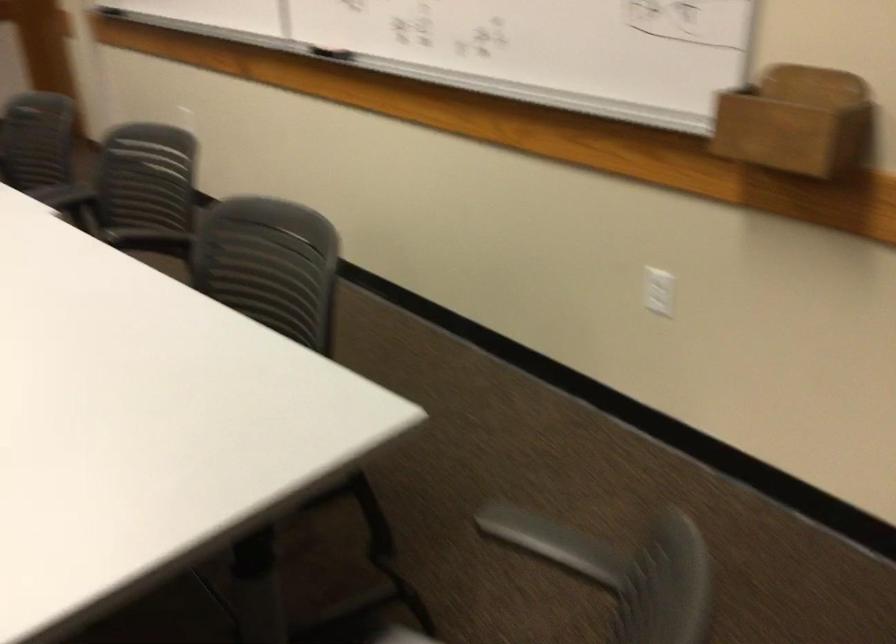
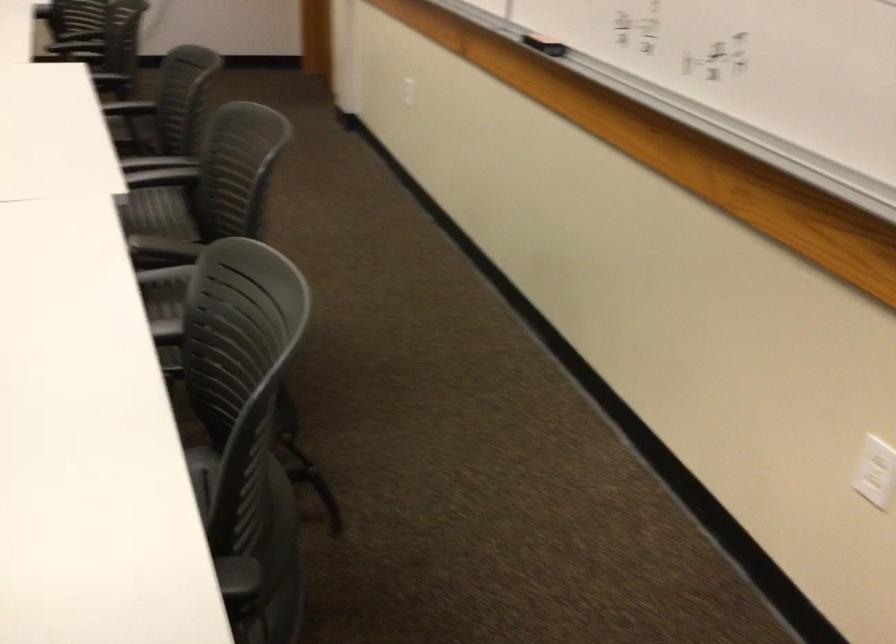
The images are taken continuously from a first-person perspective. In which direction are you moving?

The movement direction of the cameraman is right, forward.